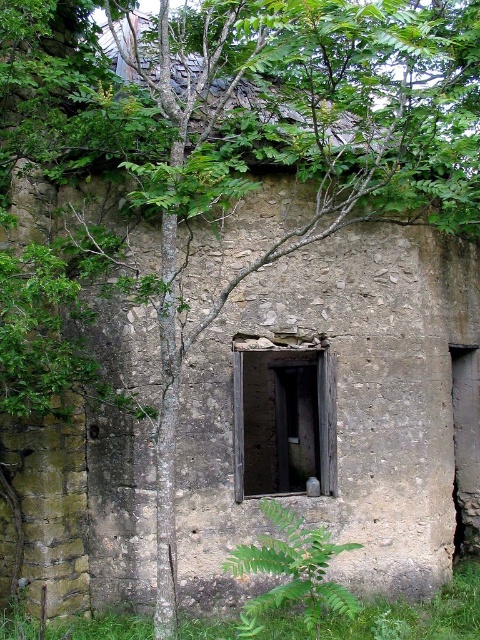
Consider the image. Who is shorter, dark wood door at center or green leafy fern at center?

Standing shorter between the two is green leafy fern at center.

Measure the distance between dark wood door at center and green leafy fern at center.

They are 3.04 meters apart.

This screenshot has height=640, width=480. I want to click on dark wood door at center, so click(x=283, y=419).

At what (x,y) coordinates should I click in order to perform the action: click on dark wood door at center. Please return your answer as a coordinate pair (x, y). Image resolution: width=480 pixels, height=640 pixels. Looking at the image, I should click on 283,419.